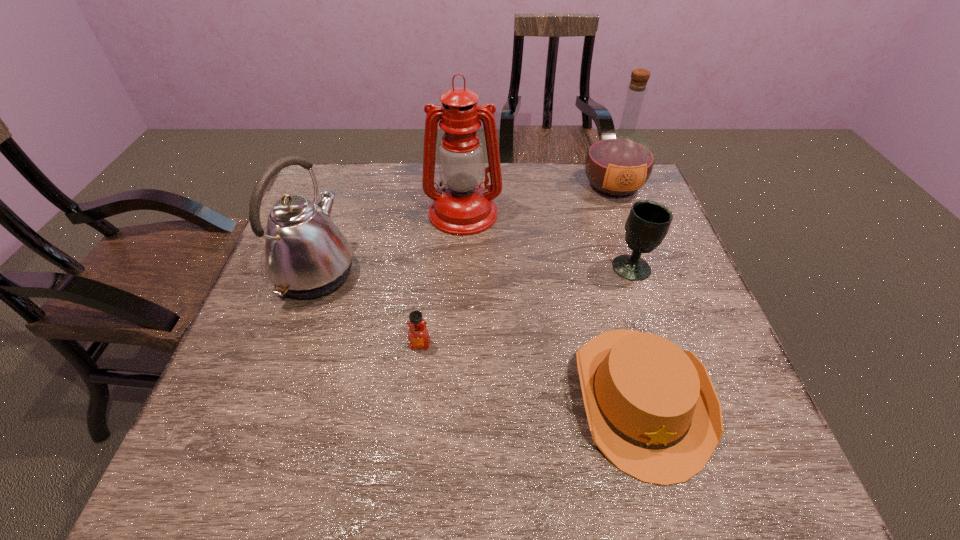
Where is `free space that is in between the oil lamp and the liquor`? This screenshot has width=960, height=540. free space that is in between the oil lamp and the liquor is located at coordinates (x=539, y=199).

Identify the location of vacant space that is in between the fourth tallest object and the leftmost object. The image size is (960, 540). (474, 270).

At what (x,y) coordinates should I click in order to perform the action: click on free space between the liquor and the cowboy hat. Please return your answer as a coordinate pair (x, y). This screenshot has height=540, width=960. Looking at the image, I should click on (627, 292).

Image resolution: width=960 pixels, height=540 pixels. I want to click on object that is the fourth nearest to the chalice, so click(x=418, y=335).

At what (x,y) coordinates should I click in order to perform the action: click on object that is the fifth nearest to the liquor. Please return your answer as a coordinate pair (x, y). The image size is (960, 540). Looking at the image, I should click on (306, 256).